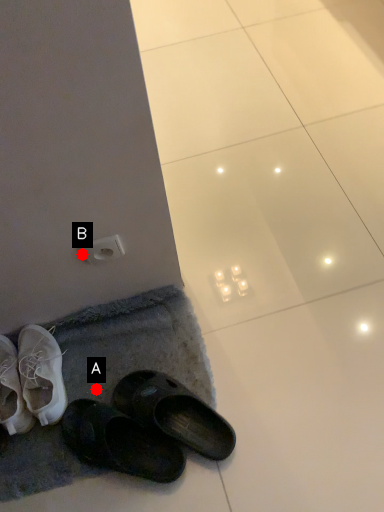
Question: Two points are circled on the image, labeled by A and B beside each circle. Which point is further to the camera?

Choices:
 (A) A is further
 (B) B is further

Answer: (A)